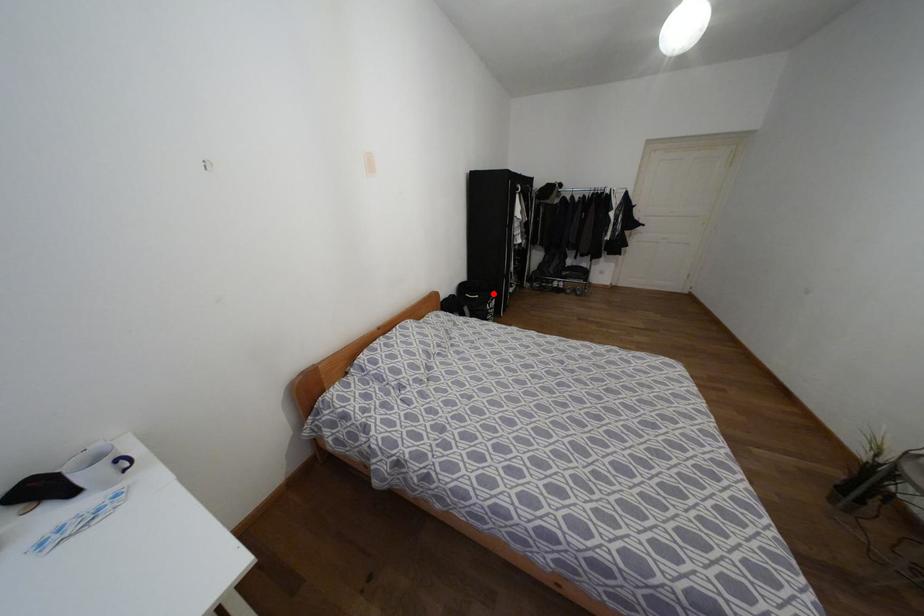
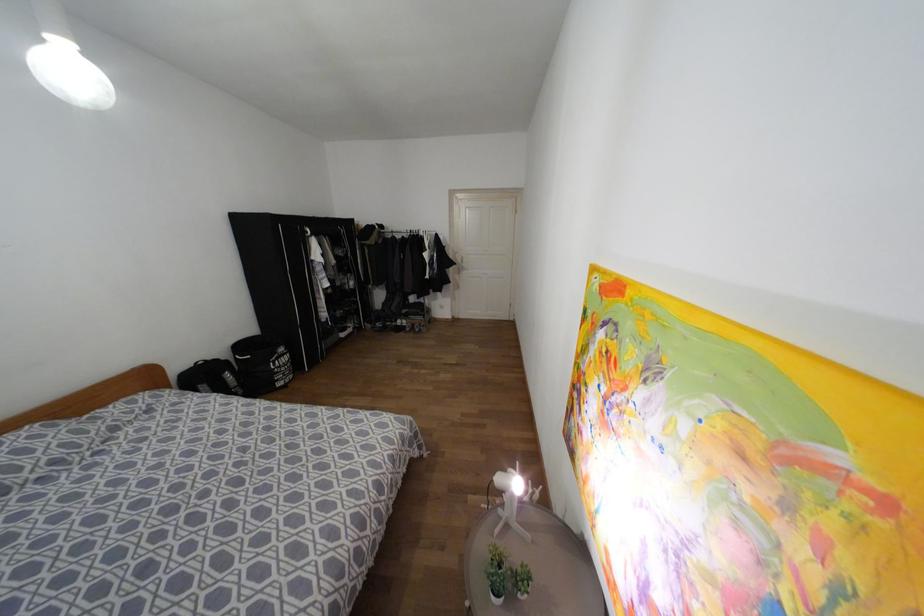
Locate, in the second image, the point that corresponds to the highlighted location in the first image.

(281, 349)